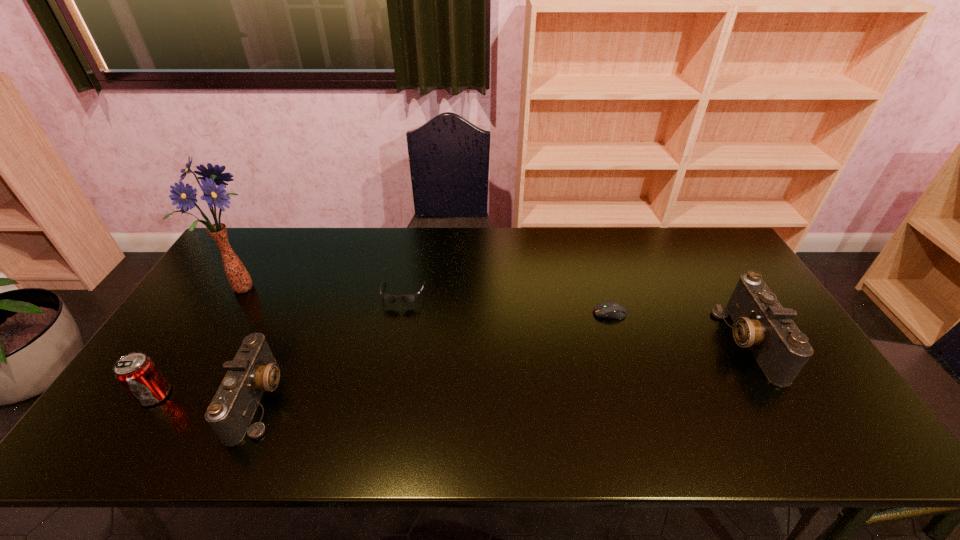
Where is `free location located on the front-facing side of the left camera`? This screenshot has height=540, width=960. free location located on the front-facing side of the left camera is located at coordinates (435, 399).

You are a GUI agent. You are given a task and a screenshot of the screen. Output one action in this format:
    pyautogui.click(x=<x>, y=<y>)
    Task: Click on the vacant space situated 0.400m on the front-facing side of the right camera
    This screenshot has width=960, height=540.
    Given the screenshot: What is the action you would take?
    pyautogui.click(x=580, y=342)

Locate an element on the screen. vacant area situated on the front-facing side of the right camera is located at coordinates (678, 342).

Locate an element on the screen. This screenshot has width=960, height=540. blank space located 0.240m on the front-facing side of the right camera is located at coordinates (638, 342).

At what (x,y) coordinates should I click in order to perform the action: click on vacant space situated on the front of the tallest object. Please return your answer as a coordinate pair (x, y). Looking at the image, I should click on (187, 379).

The height and width of the screenshot is (540, 960). Find the location of `vacant space located on the front-facing side of the fifth tallest object`. vacant space located on the front-facing side of the fifth tallest object is located at coordinates (392, 349).

Identify the location of vacant space located 0.300m on the button of the shortest object. (492, 313).

The image size is (960, 540). I want to click on free space located 0.360m on the button of the shortest object, so click(471, 313).

I want to click on vacant point located on the button of the shortest object, so point(516,313).

This screenshot has height=540, width=960. In order to click on free spot located on the back of the pop soda in this screenshot , I will do `click(207, 314)`.